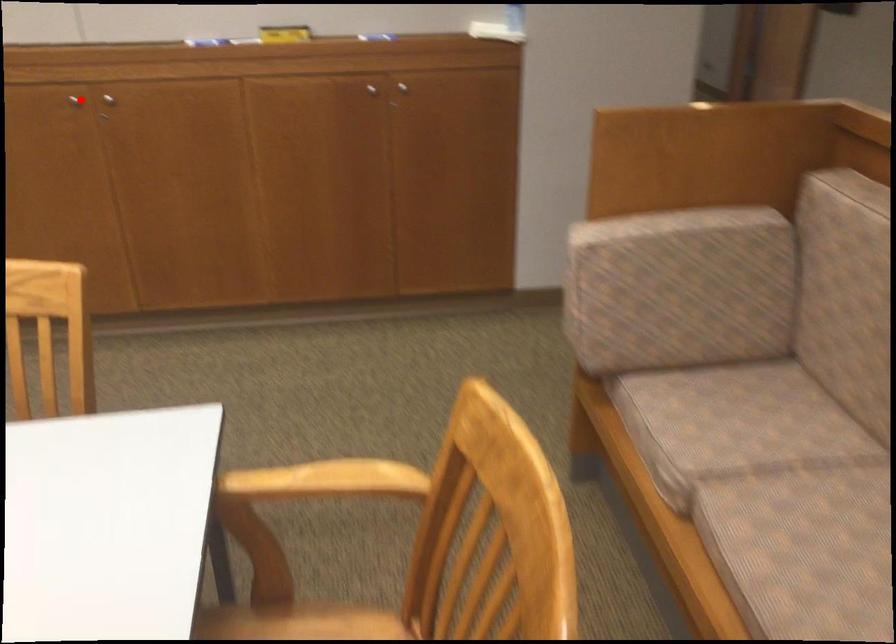
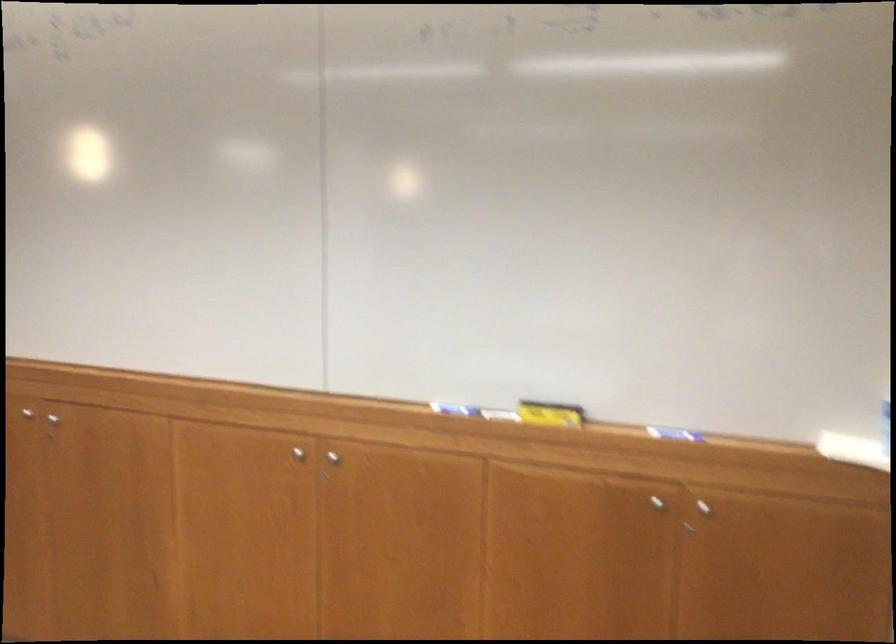
In the second image, find the point that corresponds to the highlighted location in the first image.

(297, 453)